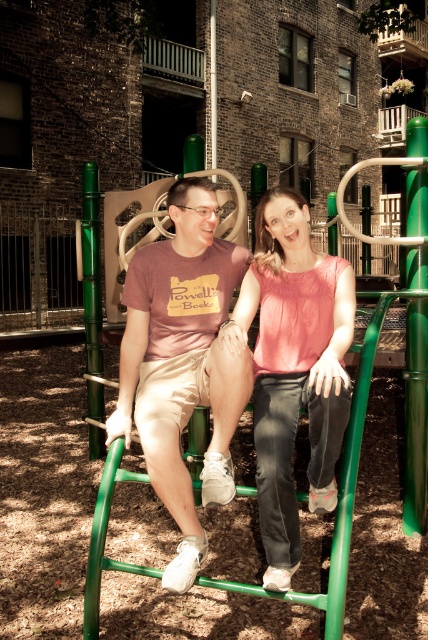
Question: Where is matte pink t-shirt at center located in relation to matte pink blouse at center in the image?

Choices:
 (A) right
 (B) left

Answer: (B)

Question: Is matte pink t-shirt at center positioned behind matte pink blouse at center?

Choices:
 (A) yes
 (B) no

Answer: (B)

Question: Among these objects, which one is nearest to the camera?

Choices:
 (A) matte pink blouse at center
 (B) matte pink t-shirt at center

Answer: (B)

Question: Can you confirm if matte pink t-shirt at center is bigger than matte pink blouse at center?

Choices:
 (A) no
 (B) yes

Answer: (B)

Question: Which of the following is the farthest from the observer?

Choices:
 (A) (258, 332)
 (B) (169, 262)

Answer: (A)

Question: Which point is closer to the camera?

Choices:
 (A) (174, 563)
 (B) (282, 397)

Answer: (A)